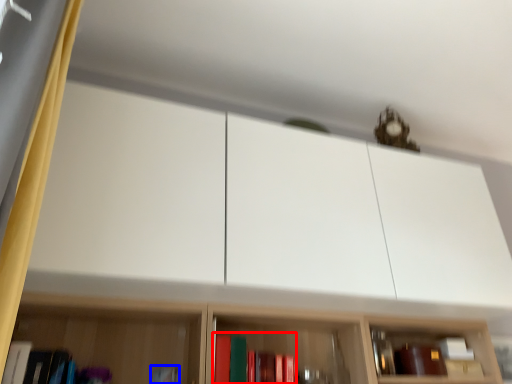
Question: Which object appears farthest to the camera in this image, book (highlighted by a red box) or book (highlighted by a blue box)?

Choices:
 (A) book
 (B) book

Answer: (B)